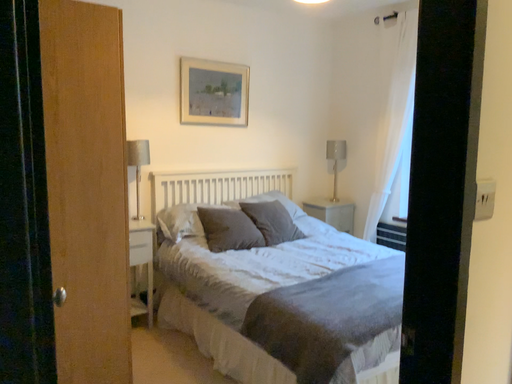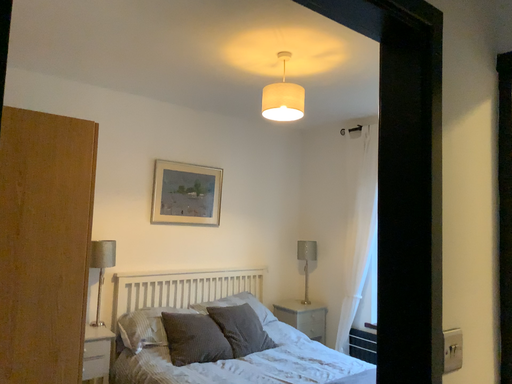
Question: How did the camera likely rotate when shooting the video?

Choices:
 (A) rotated downward
 (B) rotated upward

Answer: (B)